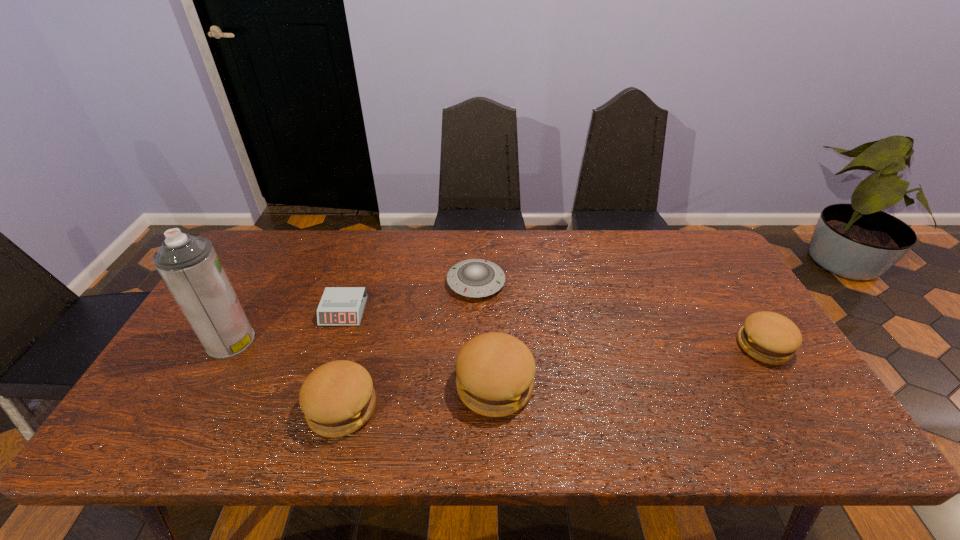
This screenshot has height=540, width=960. Find the location of `vacant spot for a new hamburger to ensure equal spacing`. vacant spot for a new hamburger to ensure equal spacing is located at coordinates (635, 366).